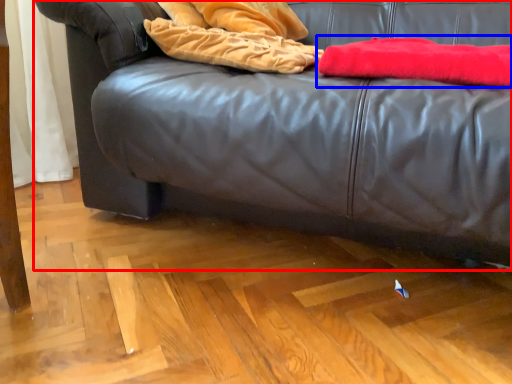
Question: Which point is further to the camera, studio couch (highlighted by a red box) or blanket (highlighted by a blue box)?

Choices:
 (A) studio couch
 (B) blanket

Answer: (B)